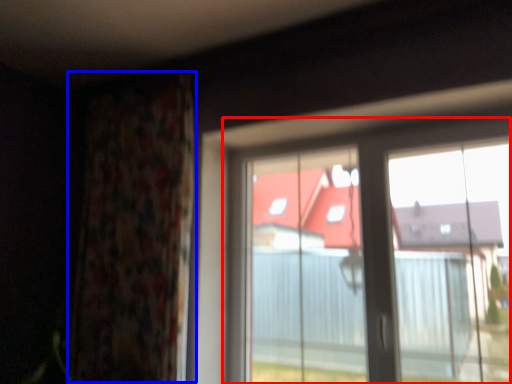
Question: Which of the following is the closest to the observer, window (highlighted by a red box) or curtain (highlighted by a blue box)?

Choices:
 (A) window
 (B) curtain

Answer: (A)